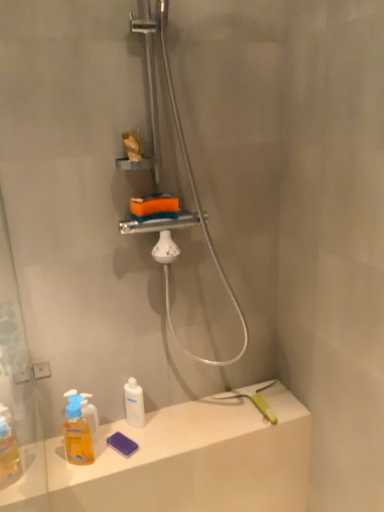
You are a GUI agent. You are given a task and a screenshot of the screen. Output one action in this format:
    pyautogui.click(x=<x>, y=<y>)
    Task: Click on the free spot above matte white counter top at lower left (from a real-world perspective)
    
    Given the screenshot: What is the action you would take?
    pyautogui.click(x=186, y=425)